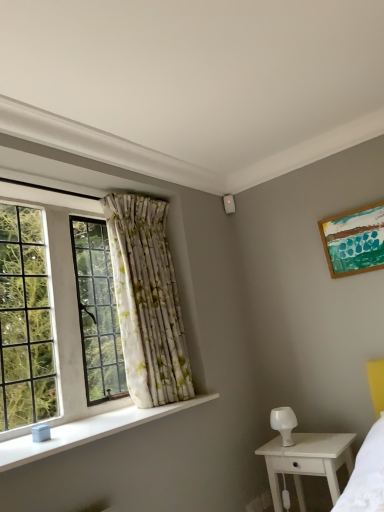
Question: Can you confirm if white floral fabric curtain at left is taller than clear glass window at left?

Choices:
 (A) yes
 (B) no

Answer: (B)

Question: Considering the relative sizes of white floral fabric curtain at left and clear glass window at left in the image provided, is white floral fabric curtain at left shorter than clear glass window at left?

Choices:
 (A) no
 (B) yes

Answer: (B)

Question: Does white floral fabric curtain at left appear on the left side of clear glass window at left?

Choices:
 (A) yes
 (B) no

Answer: (B)

Question: Does white floral fabric curtain at left lie in front of clear glass window at left?

Choices:
 (A) no
 (B) yes

Answer: (A)

Question: From the image's perspective, is white floral fabric curtain at left located above clear glass window at left?

Choices:
 (A) no
 (B) yes

Answer: (A)

Question: Is white floral fabric curtain at left smaller than clear glass window at left?

Choices:
 (A) no
 (B) yes

Answer: (A)

Question: Does white glossy lamp at lower right have a smaller size compared to clear glass window at left?

Choices:
 (A) no
 (B) yes

Answer: (B)

Question: Considering the relative sizes of white glossy lamp at lower right and clear glass window at left in the image provided, is white glossy lamp at lower right thinner than clear glass window at left?

Choices:
 (A) no
 (B) yes

Answer: (A)

Question: Is white glossy lamp at lower right behind clear glass window at left?

Choices:
 (A) no
 (B) yes

Answer: (B)

Question: Is white glossy lamp at lower right touching clear glass window at left?

Choices:
 (A) no
 (B) yes

Answer: (A)

Question: Is white glossy lamp at lower right oriented towards clear glass window at left?

Choices:
 (A) yes
 (B) no

Answer: (B)

Question: Is white glossy lamp at lower right at the left side of clear glass window at left?

Choices:
 (A) no
 (B) yes

Answer: (A)

Question: Is white wood nightstand at lower right bigger than white smooth window sill at lower left?

Choices:
 (A) yes
 (B) no

Answer: (A)